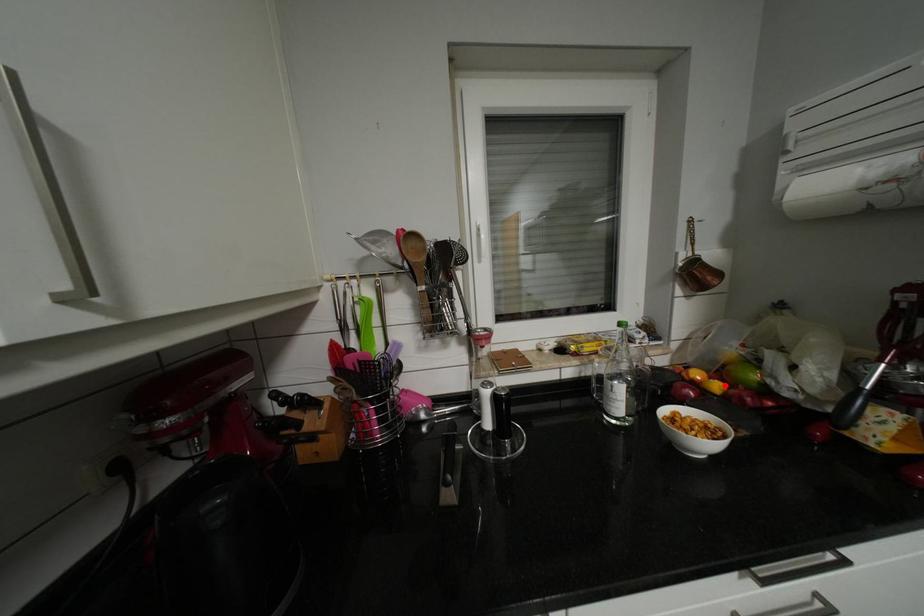
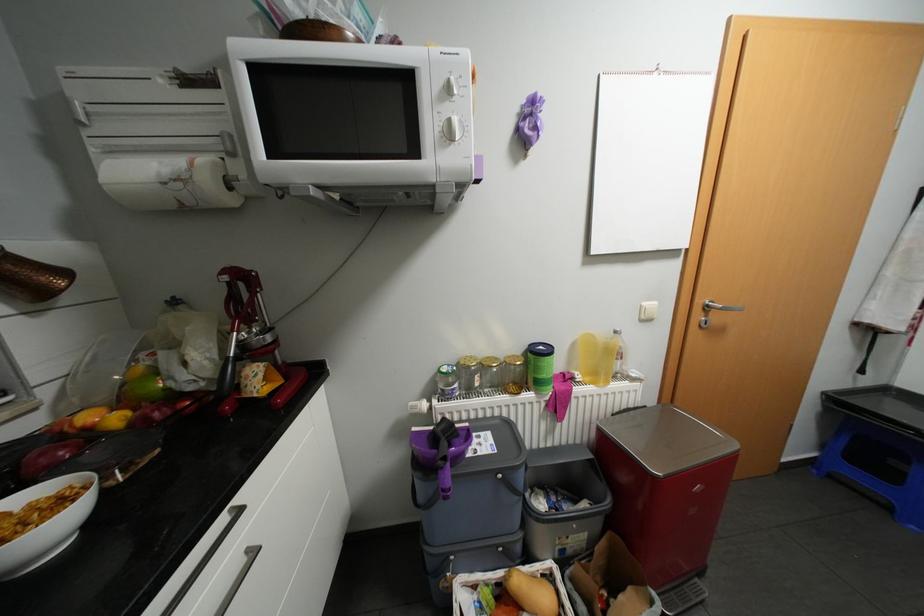
Where in the second image is the point corresponding to the highlighted location from the first image?

(123, 418)